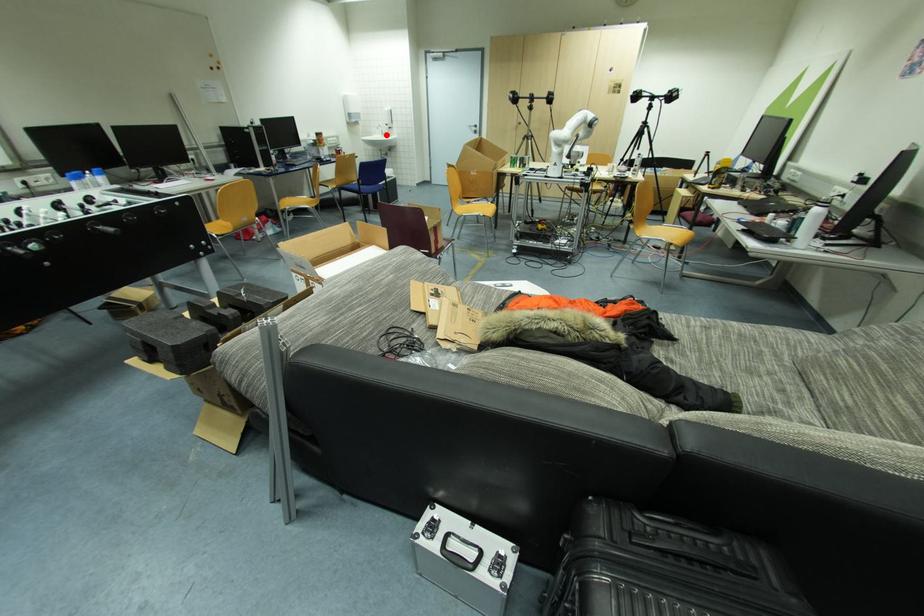
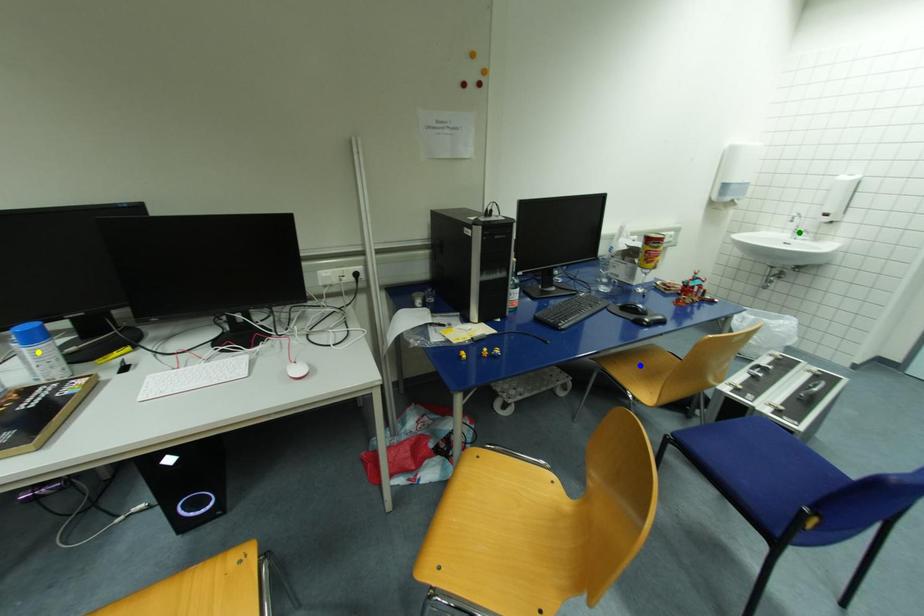
Question: I am providing you with two images of the same scene from different viewpoints. A red point is marked on the first image. You are given multiple points on the second image. Which spot in image 2 lines up with the point in image 1?

Choices:
 (A) blue point
 (B) green point
 (C) yellow point

Answer: (B)